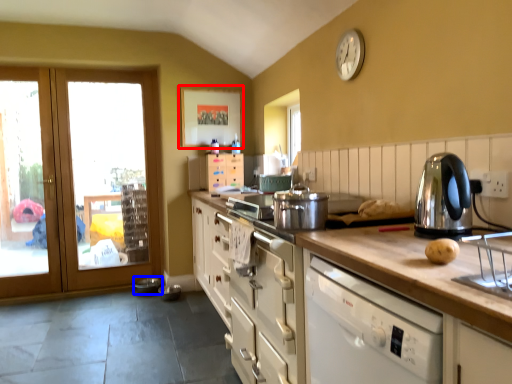
Question: Which object appears farthest to the camera in this image, picture frame (highlighted by a red box) or appliance (highlighted by a blue box)?

Choices:
 (A) picture frame
 (B) appliance

Answer: (A)